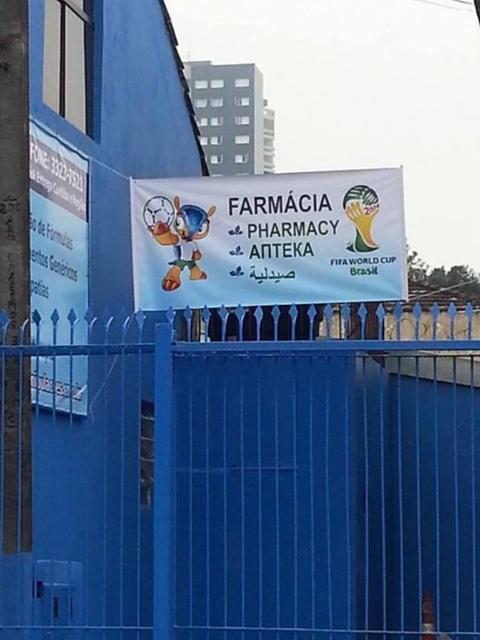
From the picture: You are standing in front of the pharmacy signboard and want to touch both the blue metal fence at center and the white fabric banner at center. Which object should you reach for first to touch the one closer to you?

The blue metal fence at center is closer to the viewer than the white fabric banner at center, so you should reach for the blue metal fence at center first.

You are a painter who needs to know which object is wider between the blue metal fence at center and the white fabric banner at center. Which one is wider?

The blue metal fence at center is wider than the white fabric banner at center according to the description.